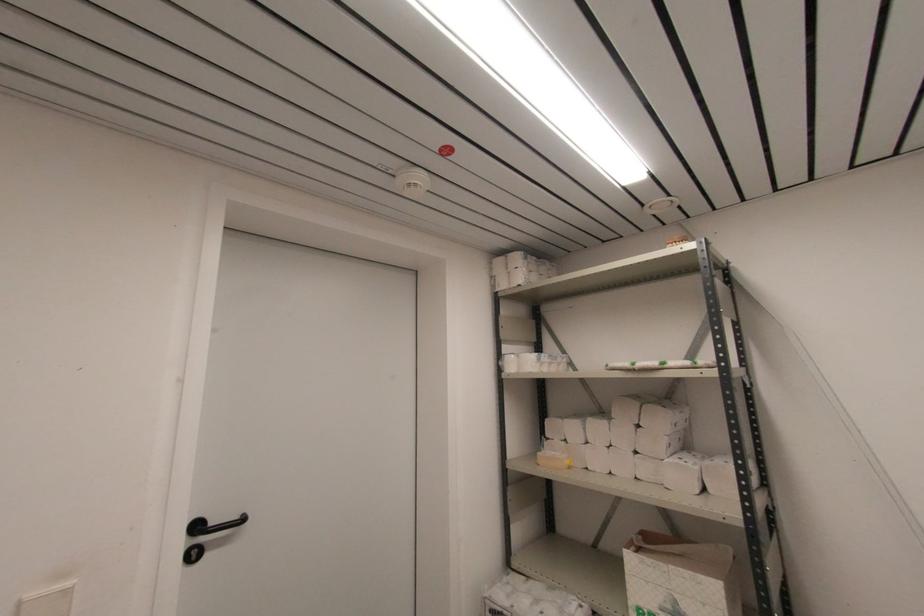
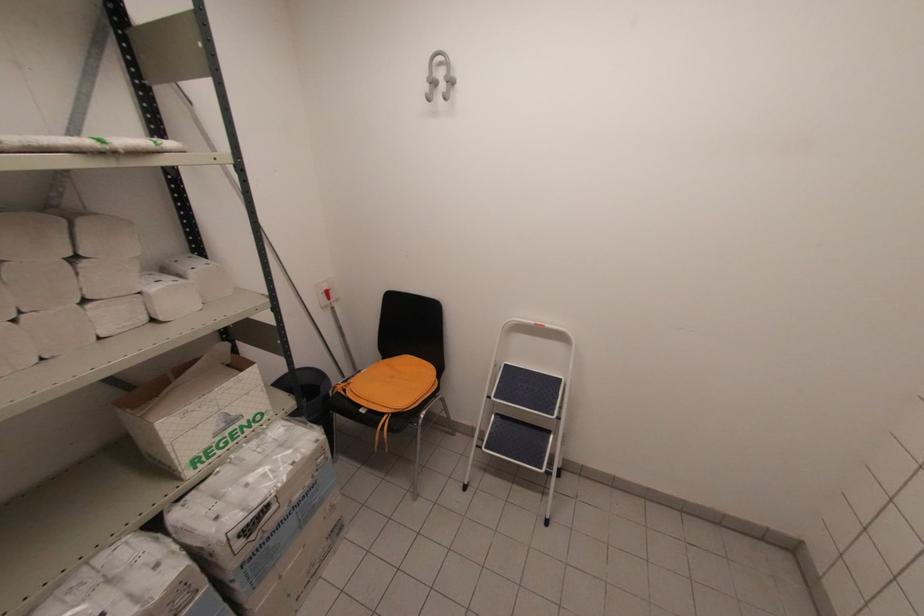
In the second image, find the point that corresponds to [641,424] in the first image.

(81, 254)